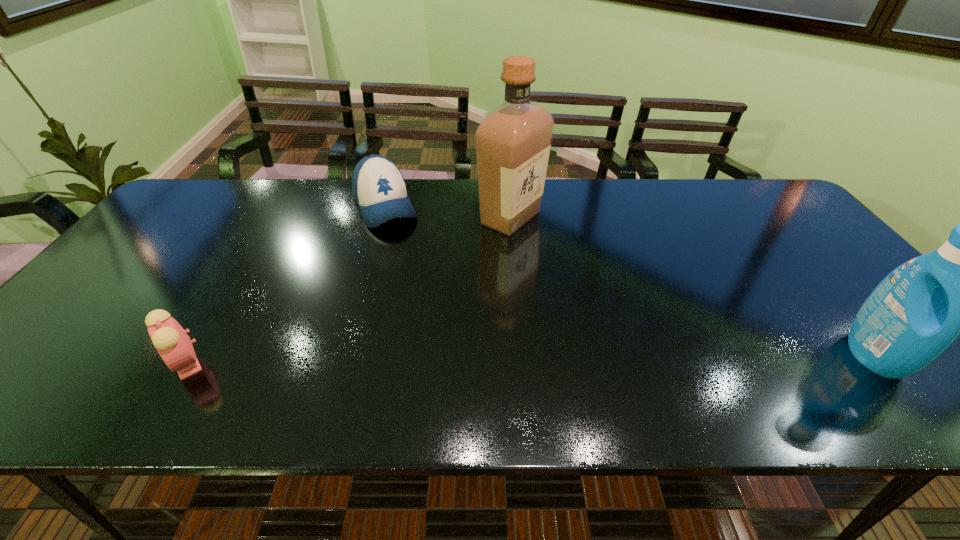
I want to click on vacant area located 0.290m on the front-facing side of the third object from left to right, so click(575, 307).

Identify the location of free space located on the front-facing side of the third object from left to right. (562, 288).

Where is `vacant space situated 0.300m on the front-facing side of the third object from left to right`? The height and width of the screenshot is (540, 960). vacant space situated 0.300m on the front-facing side of the third object from left to right is located at coordinates (577, 309).

Where is `free point located 0.310m on the front-facing side of the third object from right to left`? free point located 0.310m on the front-facing side of the third object from right to left is located at coordinates (427, 298).

Identify the location of free space located on the front-facing side of the third object from right to left. (415, 274).

Where is `free region located on the front-facing side of the third object from right to left`? This screenshot has width=960, height=540. free region located on the front-facing side of the third object from right to left is located at coordinates (404, 252).

Where is `liquor present at the far edge`? This screenshot has height=540, width=960. liquor present at the far edge is located at coordinates (513, 142).

Find the location of a particular element. The width and height of the screenshot is (960, 540). baseball cap at the far edge is located at coordinates (379, 189).

This screenshot has height=540, width=960. Identify the location of alarm clock that is at the near edge. (172, 342).

This screenshot has width=960, height=540. In order to click on detergent situated at the near edge in this screenshot , I will do `click(919, 310)`.